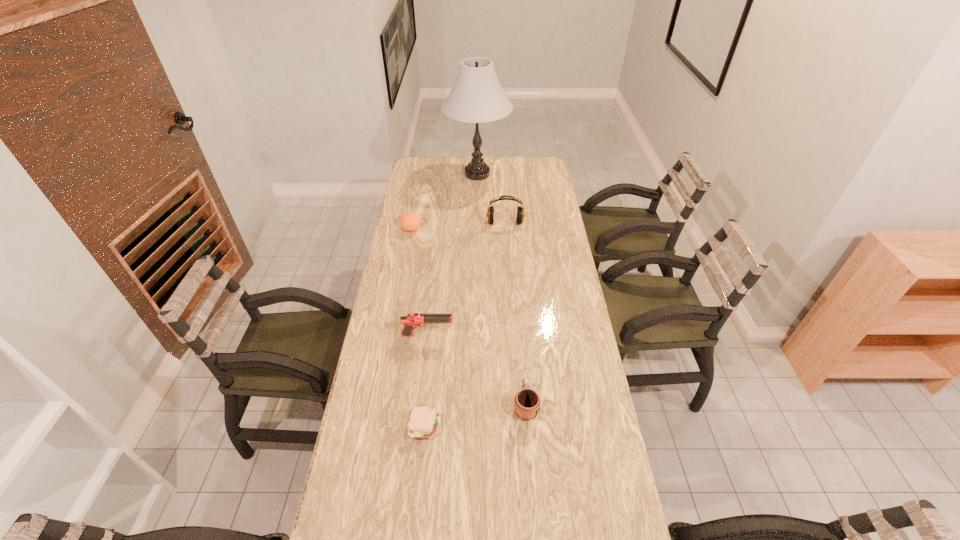
I want to click on the farthest object, so click(x=476, y=97).

Identify the location of the tallest object. (476, 97).

Image resolution: width=960 pixels, height=540 pixels. I want to click on the second tallest object, so click(520, 210).

At what (x,y) coordinates should I click in order to perform the action: click on the third nearest object. Please return your answer as a coordinate pair (x, y). Looking at the image, I should click on (412, 320).

I want to click on gun, so click(412, 320).

The height and width of the screenshot is (540, 960). I want to click on orange, so click(410, 221).

I want to click on the second shortest object, so click(527, 401).

At what (x,y) coordinates should I click in order to perform the action: click on the shortest object. Please return your answer as a coordinate pair (x, y). This screenshot has height=540, width=960. Looking at the image, I should click on (422, 423).

Identify the location of free point located on the front of the farthest object. This screenshot has width=960, height=540. (477, 221).

Where is `free space located on the ear cups of the fifth shortest object`? free space located on the ear cups of the fifth shortest object is located at coordinates (510, 286).